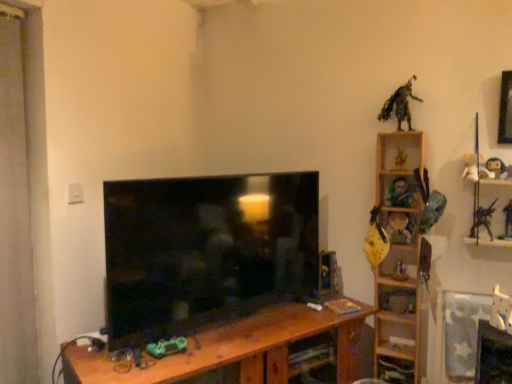
Question: Is the position of brown wood table at center less distant than that of metallic silver toy at right, which is counted as the 1th toy, starting from the right?

Choices:
 (A) no
 (B) yes

Answer: (B)

Question: From the image's perspective, is brown wood table at center located beneath metallic silver toy at right, which is counted as the 1th toy, starting from the right?

Choices:
 (A) yes
 (B) no

Answer: (A)

Question: Is brown wood table at center positioned far away from metallic silver toy at right, the twelfth toy positioned from the left?

Choices:
 (A) yes
 (B) no

Answer: (A)

Question: From a real-world perspective, is brown wood table at center located beneath metallic silver toy at right, the twelfth toy positioned from the left?

Choices:
 (A) yes
 (B) no

Answer: (A)

Question: Could you tell me if brown wood table at center is turned towards metallic silver toy at right, which is counted as the 1th toy, starting from the right?

Choices:
 (A) yes
 (B) no

Answer: (B)

Question: Does point (404, 155) appear closer or farther from the camera than point (180, 340)?

Choices:
 (A) closer
 (B) farther

Answer: (B)

Question: Choose the correct answer: Is yellow matte guitar at upper right, the 4th toy from the left, inside green matte toy car at center, which is the 1th toy from left to right, or outside it?

Choices:
 (A) inside
 (B) outside

Answer: (B)

Question: Based on their sizes in the image, would you say yellow matte guitar at upper right, the 4th toy from the left, is bigger or smaller than green matte toy car at center, which is the 1th toy from left to right?

Choices:
 (A) small
 (B) big

Answer: (A)

Question: In the image, is yellow matte guitar at upper right, the ninth toy from the right, on the left side or the right side of green matte toy car at center, which appears as the 12th toy when viewed from the right?

Choices:
 (A) right
 (B) left

Answer: (A)

Question: Based on their sizes in the image, would you say white matte figurine at upper right, the eighth toy when ordered from left to right, is bigger or smaller than green metallic figure at upper right, which appears as the third toy when viewed from the left?

Choices:
 (A) small
 (B) big

Answer: (A)

Question: Is point (472, 155) closer or farther from the camera than point (397, 91)?

Choices:
 (A) farther
 (B) closer

Answer: (B)

Question: In the image, is white matte figurine at upper right, which appears as the fifth toy when viewed from the right, positioned in front of or behind green metallic figure at upper right, marked as the 10th toy in a right-to-left arrangement?

Choices:
 (A) front
 (B) behind

Answer: (A)

Question: Do you think white matte figurine at upper right, which appears as the fifth toy when viewed from the right, is within green metallic figure at upper right, marked as the 10th toy in a right-to-left arrangement, or outside of it?

Choices:
 (A) inside
 (B) outside

Answer: (B)

Question: From their relative heights in the image, would you say metallic silver toy at upper right, positioned as the 4th toy in right-to-left order, is taller or shorter than green metallic figure at upper right, which appears as the third toy when viewed from the left?

Choices:
 (A) short
 (B) tall

Answer: (A)

Question: From a real-world perspective, is metallic silver toy at upper right, arranged as the 9th toy when viewed from the left, physically located above or below green metallic figure at upper right, marked as the 10th toy in a right-to-left arrangement?

Choices:
 (A) below
 (B) above

Answer: (A)